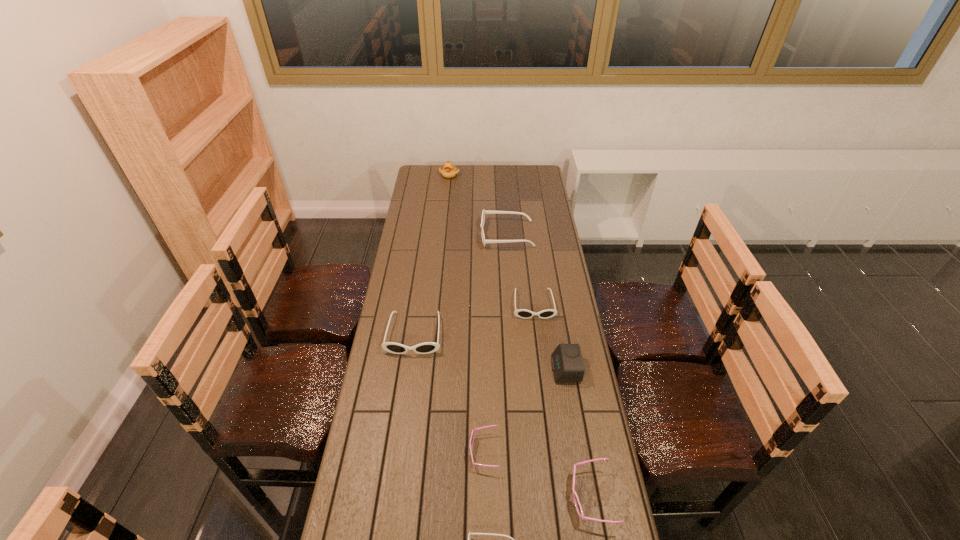
Identify the location of vacant space located 0.400m on the front-facing side of the farthest object. (444, 222).

The width and height of the screenshot is (960, 540). What are the coordinates of `vacant space located 0.130m with the lenses of the tallest sunglasses facing outward` in the screenshot? It's located at (453, 234).

Find the location of a particular element. vacant space located with the lenses of the tallest sunglasses facing outward is located at coordinates (436, 234).

This screenshot has height=540, width=960. In order to click on free space located with the lenses of the tallest sunglasses facing outward in this screenshot , I will do `click(409, 234)`.

You are a GUI agent. You are given a task and a screenshot of the screen. Output one action in this format:
    pyautogui.click(x=<x>, y=<y>)
    Task: Click on the vacant space situated on the front-facing side of the alarm clock
    The image size is (960, 540).
    Given the screenshot: What is the action you would take?
    pyautogui.click(x=527, y=369)

Identify the location of free space located on the front-facing side of the alarm clock. This screenshot has width=960, height=540. click(492, 369).

At what (x,y) coordinates should I click in order to perform the action: click on vacant position located 0.230m on the front-facing side of the alarm clock. Please return your answer as a coordinate pair (x, y). Looking at the image, I should click on (487, 369).

Image resolution: width=960 pixels, height=540 pixels. I want to click on vacant space located with the lenses of the third smallest black sunglasses facing outward, so click(406, 393).

Find the location of `vacant space located 0.350m on the front-facing side of the right pink sunglasses`. vacant space located 0.350m on the front-facing side of the right pink sunglasses is located at coordinates (444, 497).

Identify the location of vacant space situated on the front-facing side of the right pink sunglasses. (441, 497).